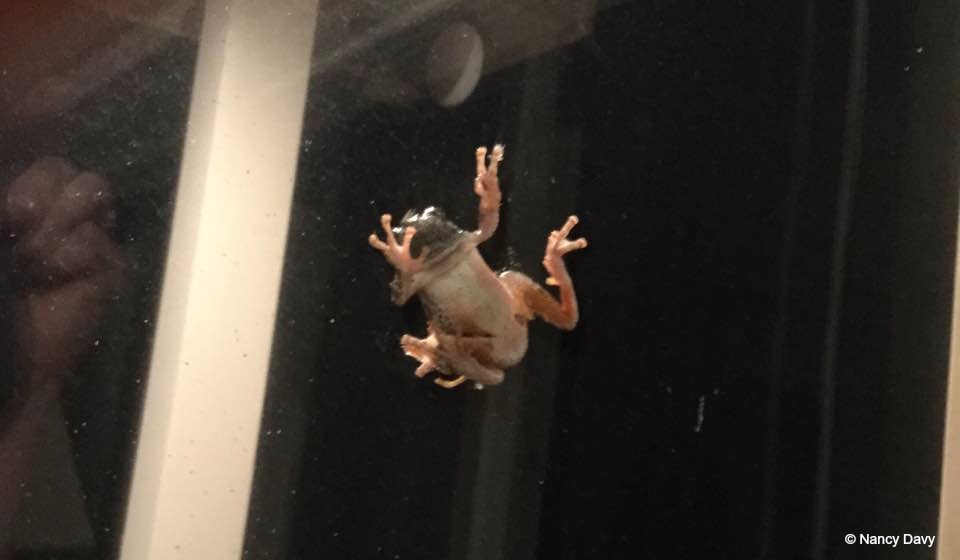
Find the location of a particular element. white windowpane edge is located at coordinates (172, 519), (222, 234), (267, 32), (950, 499).